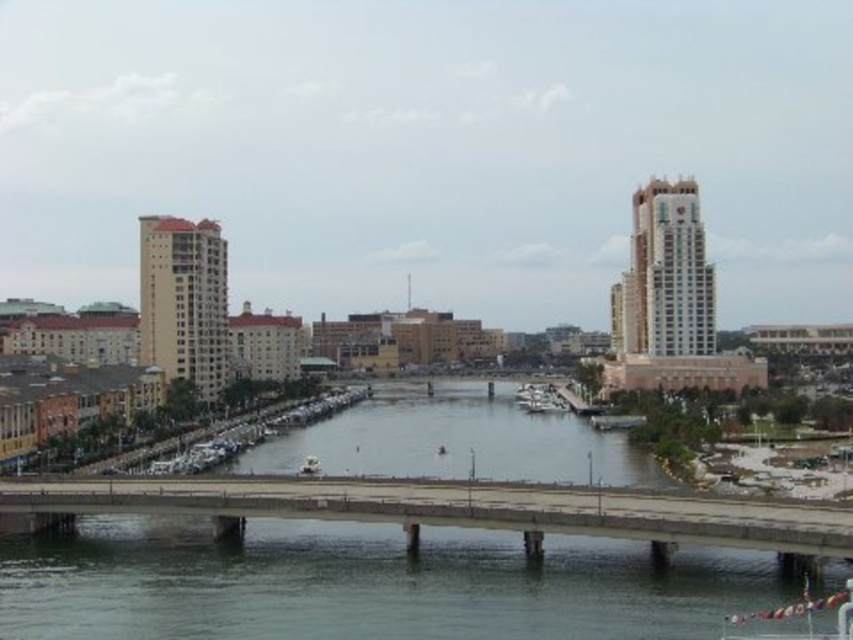
You are a GUI agent. You are given a task and a screenshot of the screen. Output one action in this format:
    pyautogui.click(x=<x>, y=<y>)
    Task: Click on the concrete bridge at center
    The width and height of the screenshot is (853, 640).
    Given the screenshot: What is the action you would take?
    pyautogui.click(x=457, y=508)

Between point (744, 522) and point (532, 408), which one is positioned behind?

Point (532, 408)

The width and height of the screenshot is (853, 640). Identify the location of concrete bridge at center. (457, 508).